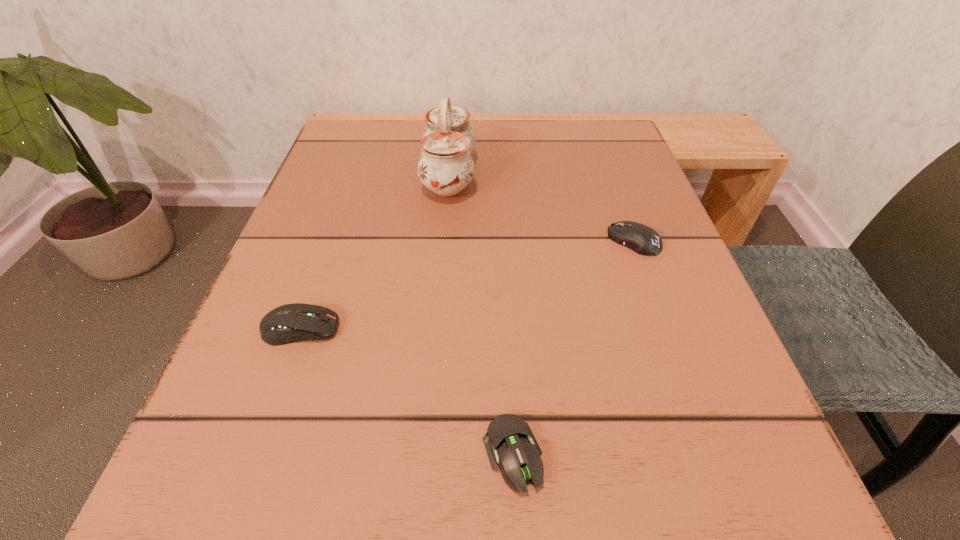
You are a GUI agent. You are given a task and a screenshot of the screen. Output one action in this format:
    pyautogui.click(x=<x>, y=<y>)
    Task: Click on the free location located 0.320m on the left of the rightmost computer mouse
    
    Given the screenshot: What is the action you would take?
    pyautogui.click(x=413, y=240)

This screenshot has height=540, width=960. Find the location of `blank area located 0.060m on the right of the third object from left to right`. blank area located 0.060m on the right of the third object from left to right is located at coordinates (598, 455).

Where is `object present at the far edge`? This screenshot has width=960, height=540. object present at the far edge is located at coordinates (445, 166).

Locate an element on the screen. object that is positioned at the near edge is located at coordinates (509, 441).

The width and height of the screenshot is (960, 540). Find the location of `object positioned at the left edge`. object positioned at the left edge is located at coordinates (295, 322).

Locate an element on the screen. Image resolution: width=960 pixels, height=540 pixels. object that is at the right edge is located at coordinates (640, 238).

Where is `vacant space at the left edge of the desktop`? The width and height of the screenshot is (960, 540). vacant space at the left edge of the desktop is located at coordinates (378, 275).

Identify the location of free spot at the right edge of the desktop. This screenshot has width=960, height=540. (645, 360).

Locate an element on the screen. The image size is (960, 540). free spot at the far right corner of the desktop is located at coordinates (561, 148).

Where is `vacant space in between the rightmost object and the second object from left to right`? This screenshot has height=540, width=960. vacant space in between the rightmost object and the second object from left to right is located at coordinates (541, 208).